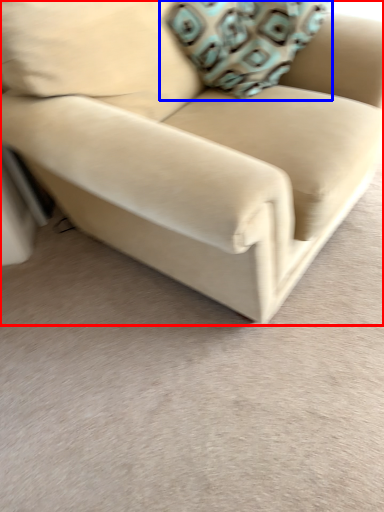
Question: Which point is closer to the camera, studio couch (highlighted by a red box) or throw pillow (highlighted by a blue box)?

Choices:
 (A) studio couch
 (B) throw pillow

Answer: (A)